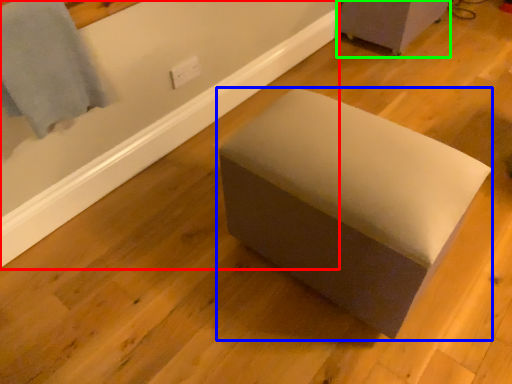
Question: Considering the real-world distances, which object is closest to bath (highlighted by a red box)? furniture (highlighted by a blue box) or furniture (highlighted by a green box).

Choices:
 (A) furniture
 (B) furniture

Answer: (A)